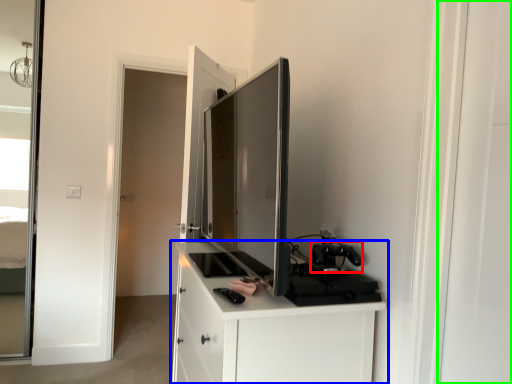
Question: Which is farther away from appliance (highlighted by a red box)? cabinetry (highlighted by a blue box) or screen door (highlighted by a green box)?

Choices:
 (A) cabinetry
 (B) screen door

Answer: (B)